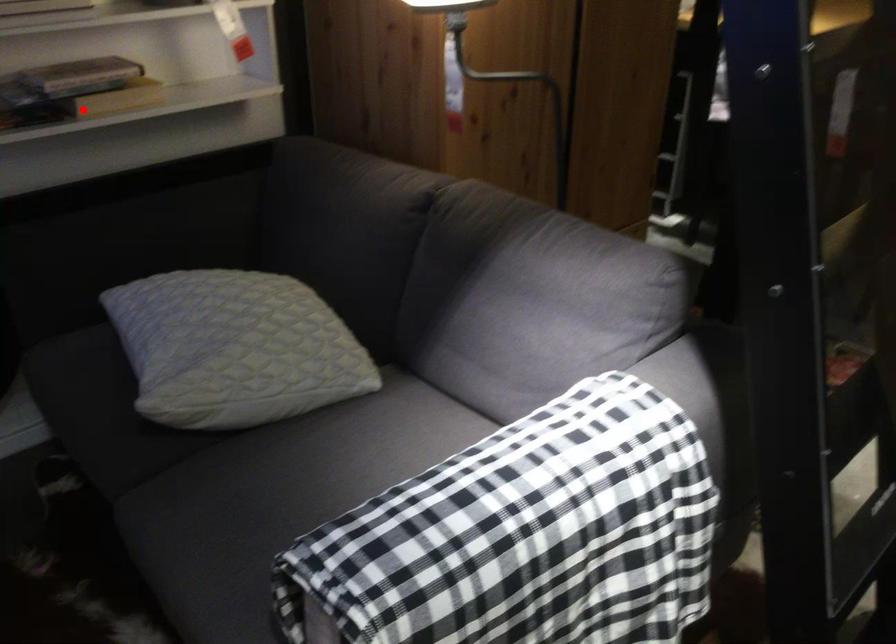
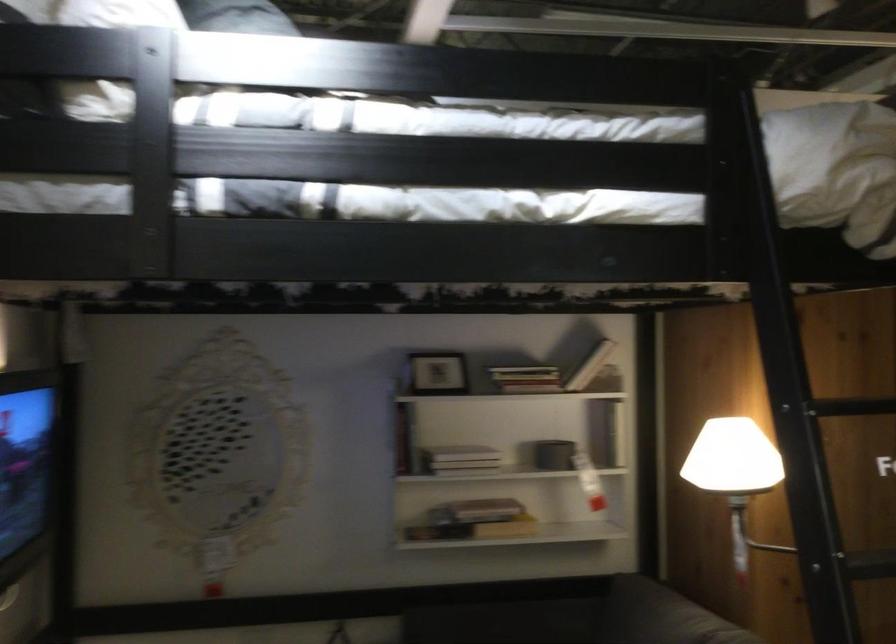
Question: I am providing you with two images of the same scene from different viewpoints. In image1, a red point is highlighted. Considering the same 3D point in image2, which of the following is correct?

Choices:
 (A) It is closer
 (B) It is farther

Answer: (B)